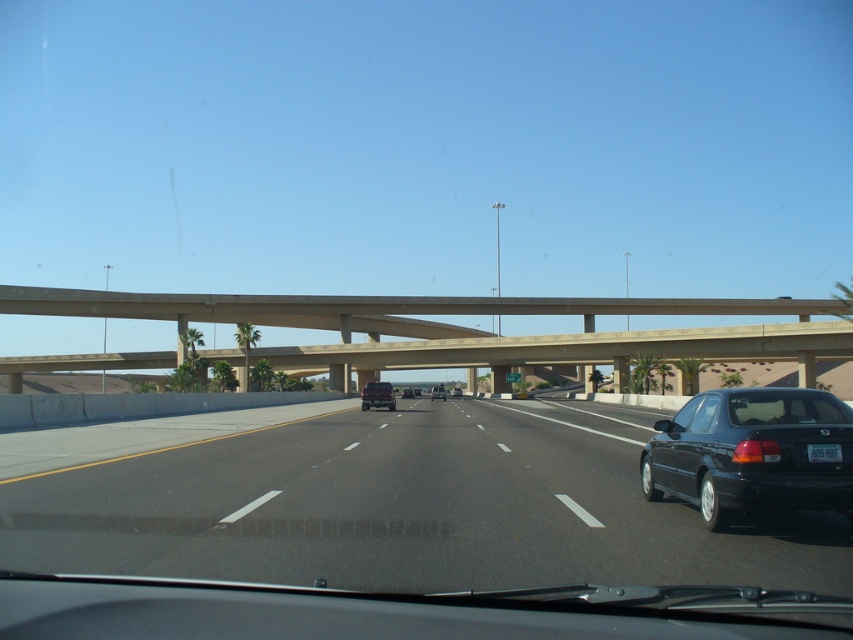
Between concrete bridge at center and matte black sedan at center, which one is positioned lower?

matte black sedan at center is lower down.

Who is more forward, [660,348] or [366,404]?

Positioned in front is point [366,404].

Between point (16, 300) and point (376, 392), which one is positioned behind?

The point (16, 300) is behind.

At what (x,y) coordinates should I click in order to perform the action: click on concrete bridge at center. Please return your answer as a coordinate pair (x, y). This screenshot has width=853, height=640. Looking at the image, I should click on (457, 324).

Can you confirm if transparent glass windshield at center is shorter than black glossy sedan at center?

Correct, transparent glass windshield at center is not as tall as black glossy sedan at center.

Does point (786, 422) come in front of point (457, 394)?

That is True.

Find the location of a particular element. This screenshot has width=853, height=640. transparent glass windshield at center is located at coordinates (786, 406).

Is black asphalt highway at center closer to the viewer compared to black glossy sedan at center?

Yes, black asphalt highway at center is in front of black glossy sedan at center.

Measure the distance between black asphalt highway at center and camera.

A distance of 6.37 meters exists between black asphalt highway at center and camera.

Identify the location of black asphalt highway at center. The height and width of the screenshot is (640, 853). (408, 508).